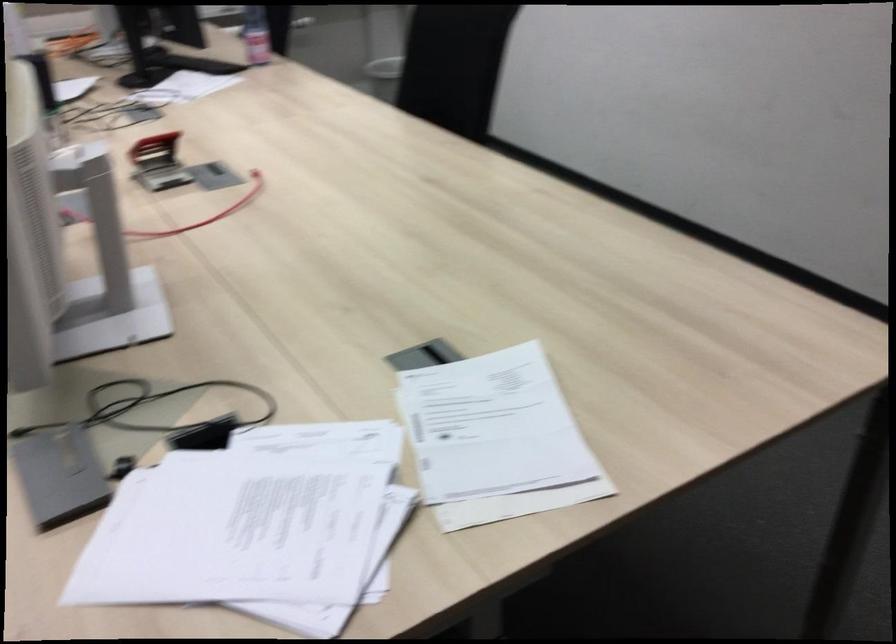
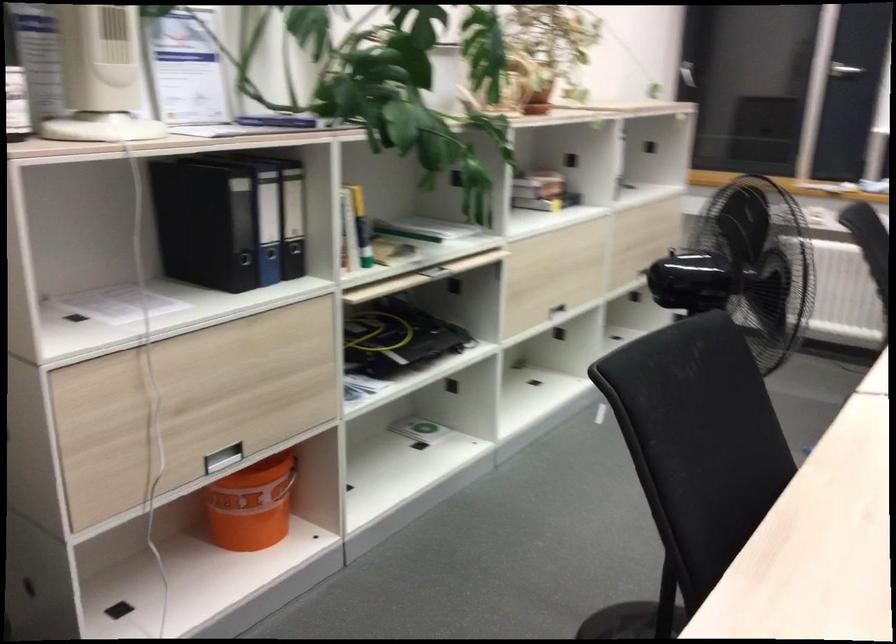
Question: The camera is either moving clockwise (left) or counter-clockwise (right) around the object. The first image is from the beginning of the video and the second image is from the end. Is the camera moving left or right when shooting the video?

Choices:
 (A) Left
 (B) Right

Answer: (B)